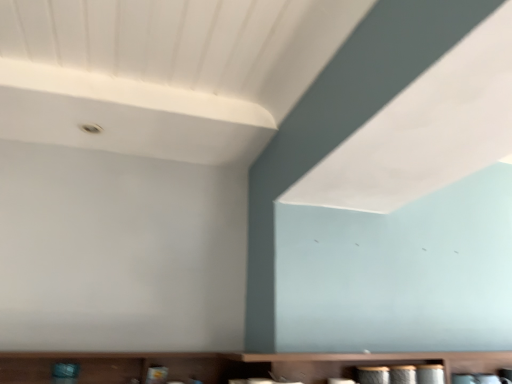
Image resolution: width=512 pixels, height=384 pixels. What do you see at coordinates (111, 366) in the screenshot?
I see `brown wood cabinet at lower center` at bounding box center [111, 366].

You are a GUI agent. You are given a task and a screenshot of the screen. Output one action in this format:
    pyautogui.click(x=<x>, y=<y>)
    Task: Click on the brown wood cabinet at lower center
    
    Given the screenshot: What is the action you would take?
    pyautogui.click(x=111, y=366)

The image size is (512, 384). I want to click on brown wood cabinet at lower center, so click(111, 366).